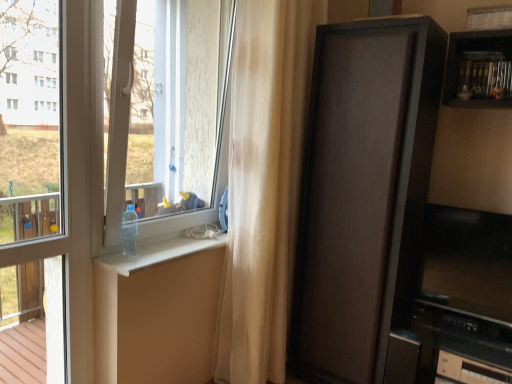
Question: Is transparent plastic window screen at left positioned with its back to sheer beige curtain at center?

Choices:
 (A) yes
 (B) no

Answer: (B)

Question: Is sheer beige curtain at center surrounded by transparent plastic window screen at left?

Choices:
 (A) no
 (B) yes

Answer: (A)

Question: Considering the relative positions of transparent plastic window screen at left and sheer beige curtain at center in the image provided, is transparent plastic window screen at left to the left of sheer beige curtain at center from the viewer's perspective?

Choices:
 (A) no
 (B) yes

Answer: (B)

Question: Is transparent plastic window screen at left smaller than sheer beige curtain at center?

Choices:
 (A) no
 (B) yes

Answer: (B)

Question: Is transparent plastic window screen at left directly adjacent to sheer beige curtain at center?

Choices:
 (A) no
 (B) yes

Answer: (A)

Question: Does transparent plastic window screen at left have a lesser width compared to sheer beige curtain at center?

Choices:
 (A) yes
 (B) no

Answer: (A)

Question: Is black plastic drawer at lower right at the back of transparent plastic window screen at left?

Choices:
 (A) yes
 (B) no

Answer: (B)

Question: Does transparent plastic window screen at left appear on the left side of black plastic drawer at lower right?

Choices:
 (A) no
 (B) yes

Answer: (B)

Question: Is transparent plastic window screen at left far from black plastic drawer at lower right?

Choices:
 (A) yes
 (B) no

Answer: (A)

Question: Is transparent plastic window screen at left in contact with black plastic drawer at lower right?

Choices:
 (A) no
 (B) yes

Answer: (A)

Question: Is transparent plastic window screen at left positioned in front of black plastic drawer at lower right?

Choices:
 (A) no
 (B) yes

Answer: (B)

Question: Is transparent plastic window screen at left located outside black plastic drawer at lower right?

Choices:
 (A) no
 (B) yes

Answer: (B)

Question: Is matte brown cabinet at right turned away from sheer beige curtain at center?

Choices:
 (A) no
 (B) yes

Answer: (A)